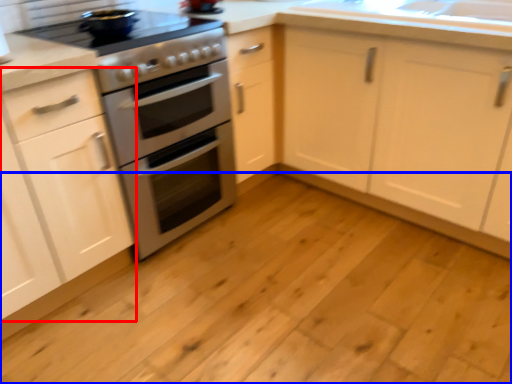
Question: Which of the following is the closest to the observer, cabinetry (highlighted by a red box) or plain (highlighted by a blue box)?

Choices:
 (A) cabinetry
 (B) plain

Answer: (B)